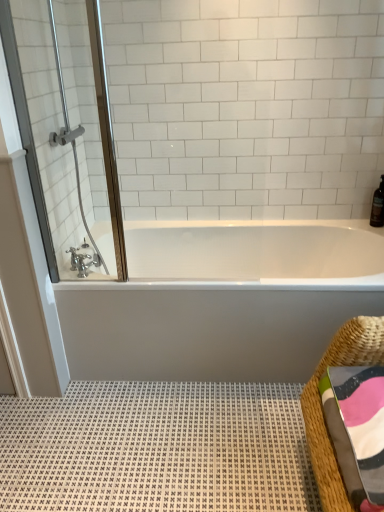
Question: Does brushed metal faucet at lower left have a lesser width compared to woven straw basket at lower right?

Choices:
 (A) yes
 (B) no

Answer: (A)

Question: Can you confirm if brushed metal faucet at lower left is shorter than woven straw basket at lower right?

Choices:
 (A) yes
 (B) no

Answer: (A)

Question: From the image's perspective, is brushed metal faucet at lower left on woven straw basket at lower right?

Choices:
 (A) no
 (B) yes

Answer: (B)

Question: From the image's perspective, is brushed metal faucet at lower left below woven straw basket at lower right?

Choices:
 (A) no
 (B) yes

Answer: (A)

Question: Can you confirm if brushed metal faucet at lower left is positioned to the right of woven straw basket at lower right?

Choices:
 (A) yes
 (B) no

Answer: (B)

Question: Is brushed metal faucet at lower left bigger than woven straw basket at lower right?

Choices:
 (A) no
 (B) yes

Answer: (A)

Question: Is brown glass bottle at upper right to the right of woven straw basket at lower right from the viewer's perspective?

Choices:
 (A) yes
 (B) no

Answer: (A)

Question: Is brown glass bottle at upper right not close to woven straw basket at lower right?

Choices:
 (A) no
 (B) yes

Answer: (B)

Question: Is the depth of brown glass bottle at upper right less than that of woven straw basket at lower right?

Choices:
 (A) no
 (B) yes

Answer: (A)

Question: Can you confirm if brown glass bottle at upper right is taller than woven straw basket at lower right?

Choices:
 (A) yes
 (B) no

Answer: (B)

Question: From a real-world perspective, does brown glass bottle at upper right sit lower than woven straw basket at lower right?

Choices:
 (A) no
 (B) yes

Answer: (A)

Question: Is brown glass bottle at upper right smaller than woven straw basket at lower right?

Choices:
 (A) yes
 (B) no

Answer: (A)

Question: Can we say woven straw basket at lower right lies outside brown glass bottle at upper right?

Choices:
 (A) no
 (B) yes

Answer: (B)